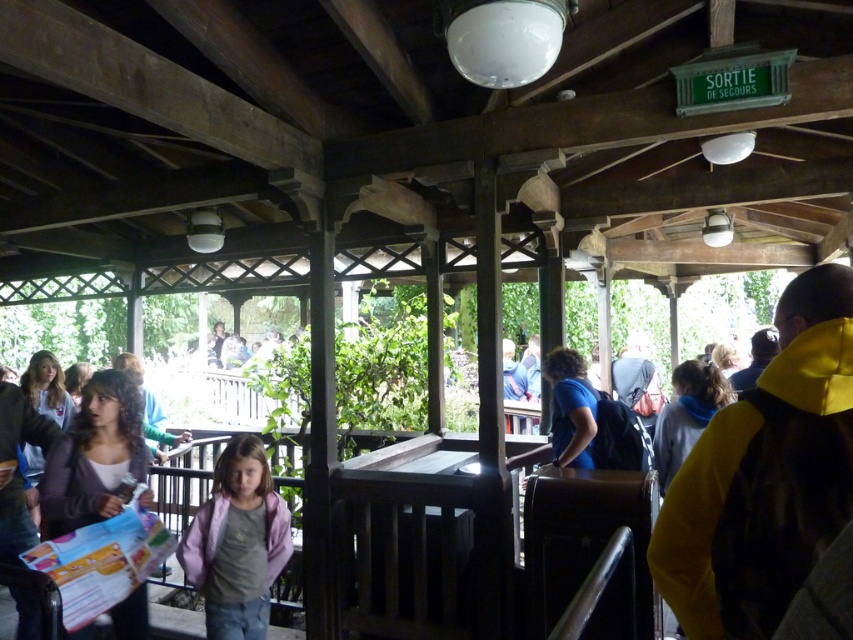
You are a photographer trying to capture a photo of both the yellow fleece jacket at right and the pink fabric jacket at center. Since you want to ensure both are visible in the frame, which jacket should you focus on first to account for their sizes?

The yellow fleece jacket at right is shorter than the pink fabric jacket at center, so you should focus on the pink fabric jacket at center first to ensure it fits within the frame.

You are standing at point (x=138, y=600) and want to move to the emergency exit sign. The emergency exit sign is located at point (x=277, y=532). Is the emergency exit sign behind you or in front of you?

The emergency exit sign is located at point (x=277, y=532), which is behind point (x=138, y=600). Therefore, the emergency exit sign is behind you.

You are standing at the emergency exit sign in the pavilion and want to move towards the glass railing. There are two points marked on the floor as reference points. The first point is at coordinates point (115, 392) and the second point is at coordinates point (683, 412). Which point should you head towards to reach the glass railing?

Point (115, 392) is in front of point (683, 412), so you should head towards point (115, 392) to reach the glass railing.